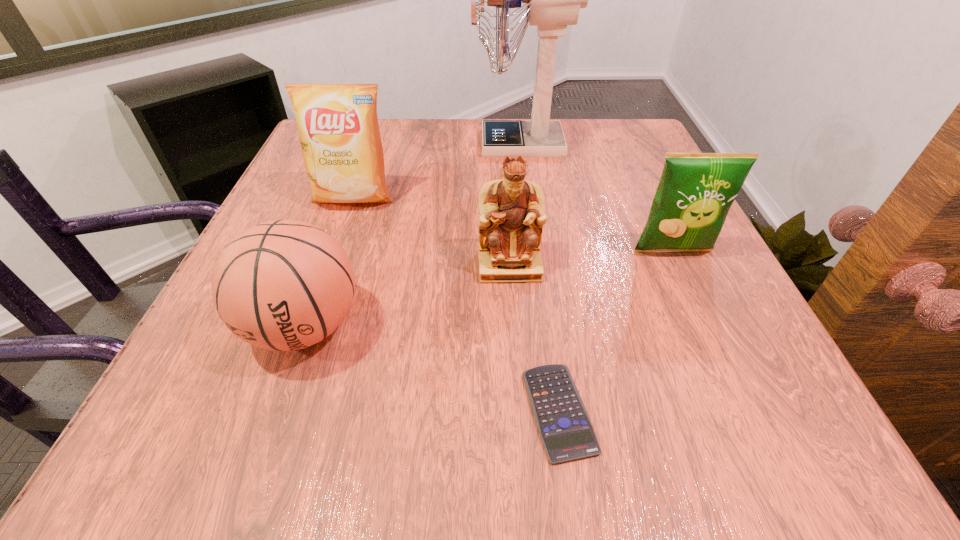
Identify the location of vacant space that is in between the figurine and the calculator. (534, 338).

What are the coordinates of `vacant area between the right crisp (potato chip) and the figurine` in the screenshot? It's located at (591, 258).

Where is `free space between the figurine and the calculator`? free space between the figurine and the calculator is located at coordinates (534, 338).

Find the location of a particular element. empty space that is in between the figurine and the left crisp (potato chip) is located at coordinates (431, 232).

Find the location of a particular element. The height and width of the screenshot is (540, 960). vacant space in between the farthest object and the basketball is located at coordinates (412, 235).

Identify which object is the fourth closest to the calculator. Please provide its 2D coordinates. Your answer should be formatted as a tuple, i.e. [(x, y)], where the tuple contains the x and y coordinates of a point satisfying the conditions above.

[(338, 127)]

I want to click on object identified as the closest to the fan, so click(x=338, y=127).

Find the location of a particular element. vacant space that satisfies the following two spatial constraints: 1. on the front-facing side of the figurine; 2. on the right side of the shortest object is located at coordinates (519, 411).

I want to click on free space that satisfies the following two spatial constraints: 1. on the front-facing side of the fan; 2. on the surface of the basketball near the brand logo, so click(542, 326).

Find the location of a particular element. vacant region that satisfies the following two spatial constraints: 1. on the front-facing side of the fan; 2. on the surface of the basketball near the brand logo is located at coordinates (542, 326).